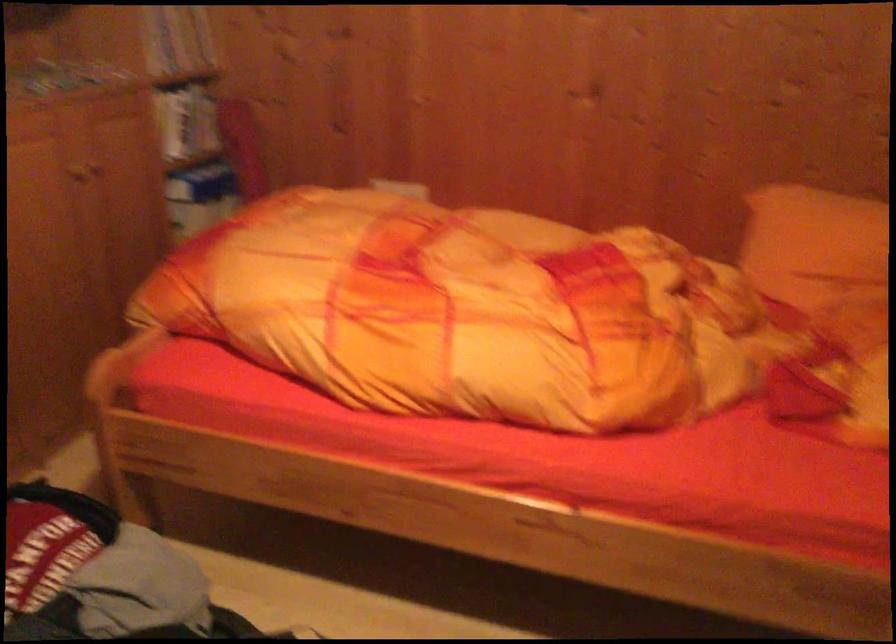
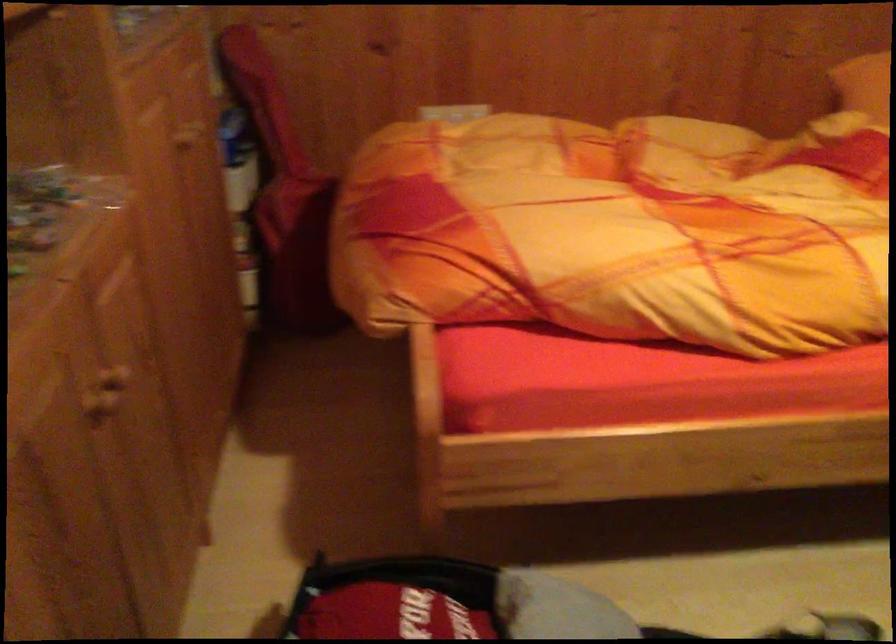
From the picture: In a continuous first-person perspective shot, in which direction is the camera moving?

The cameraman moved toward left, forward.